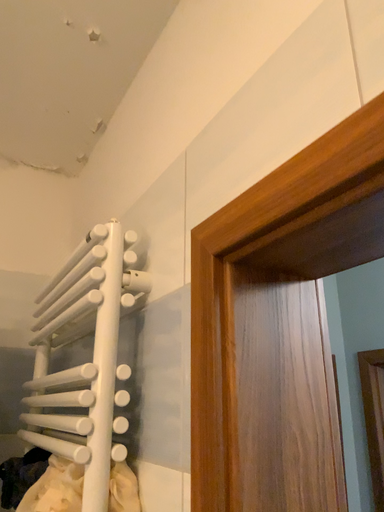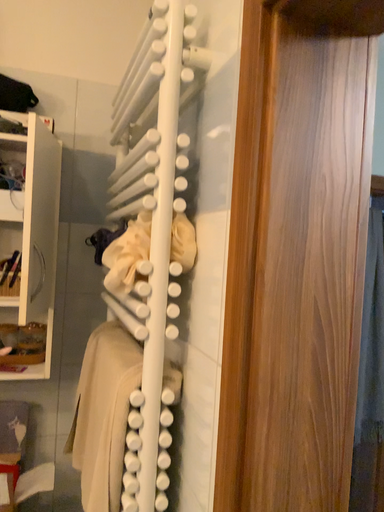
Question: How did the camera likely rotate when shooting the video?

Choices:
 (A) rotated downward
 (B) rotated upward

Answer: (A)